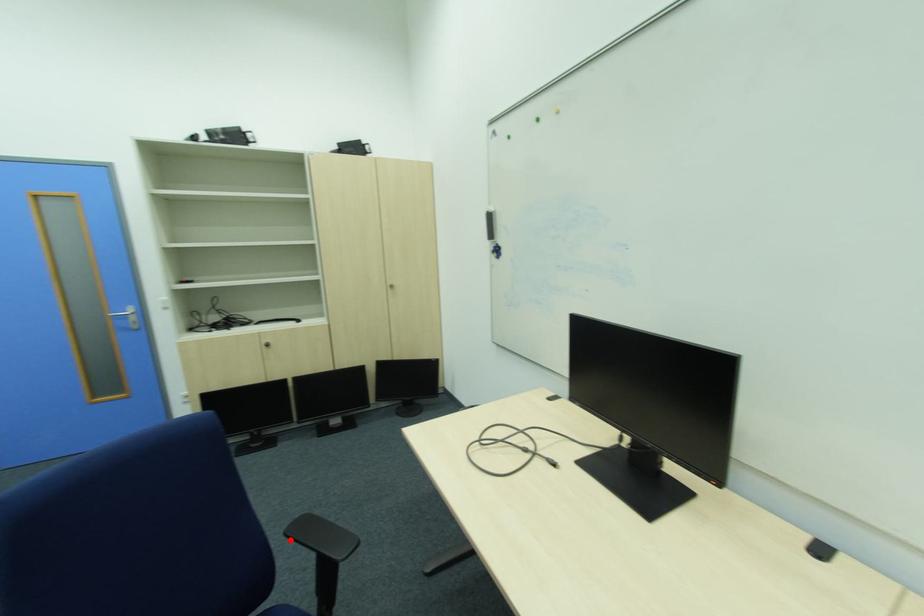
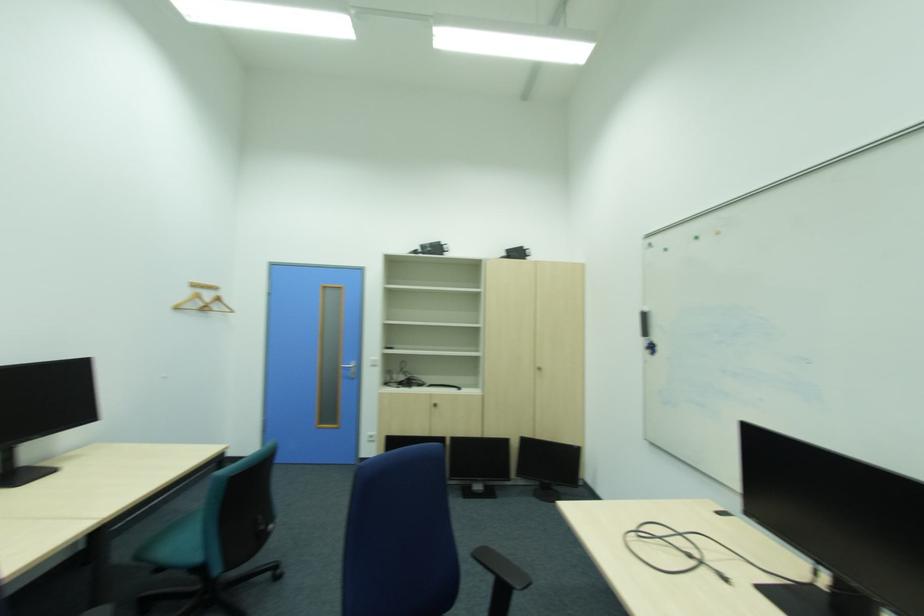
Question: I am providing you with two images of the same scene from different viewpoints. A red point is marked on the first image. At the location where the point appears in image 1, is it still visible in image 2?

Choices:
 (A) Yes
 (B) No

Answer: (A)